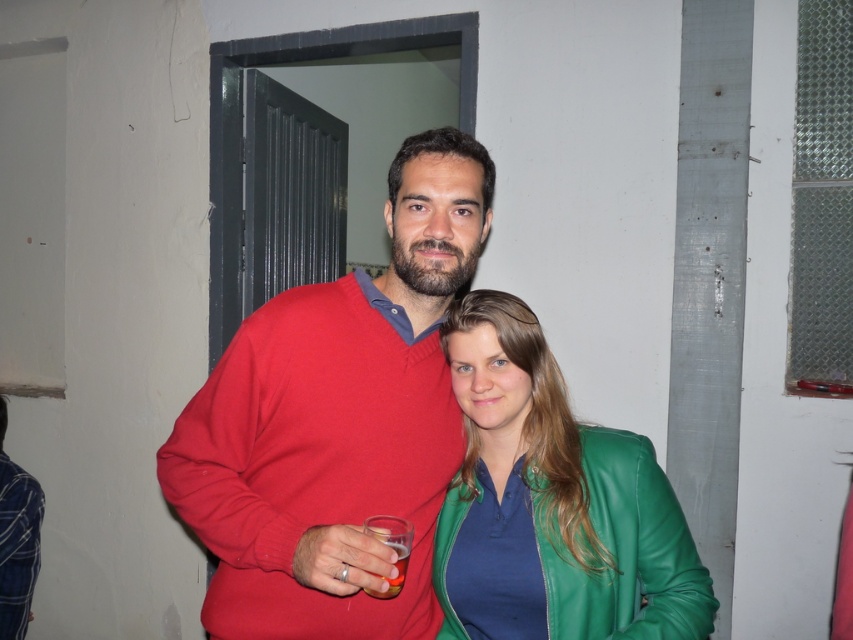
You are standing in the room and want to move from the point at coordinate (480, 572) to the point at coordinate (390, 540). Which direction should you move in relation to the camera?

You should move away from the camera because point (480, 572) is closer to the camera than point (390, 540).

You are standing 5 feet away from the camera and want to grab the matte red sweater at center. Can you reach it without moving closer?

The matte red sweater at center is 3.43 feet from the camera. Since you are 5 feet away, you are farther than the sweater, so you cannot reach it without moving closer.

You are at a party and need to decide whether to place a new decorative item on the green leather jacket at center or the translucent plastic cup at center. Which one can hold the item better based on their sizes?

The green leather jacket at center has a larger size compared to the translucent plastic cup at center, so it can hold the item better.